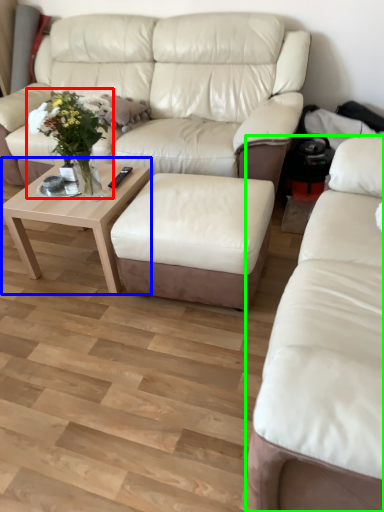
Question: Which object is positioned closest to floral arrangement (highlighted by a red box)? Select from coffee table (highlighted by a blue box) and studio couch (highlighted by a green box).

Choices:
 (A) coffee table
 (B) studio couch

Answer: (A)